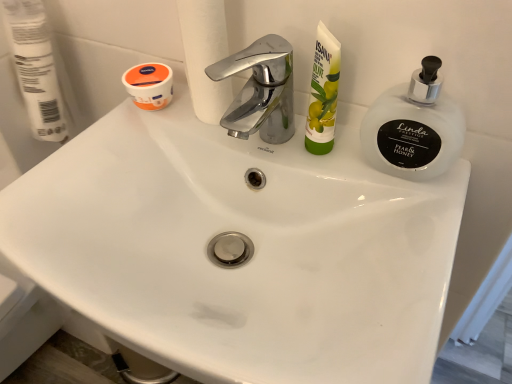
Where is `free space on the front side of orange matte jar at upper left`? This screenshot has height=384, width=512. free space on the front side of orange matte jar at upper left is located at coordinates (114, 155).